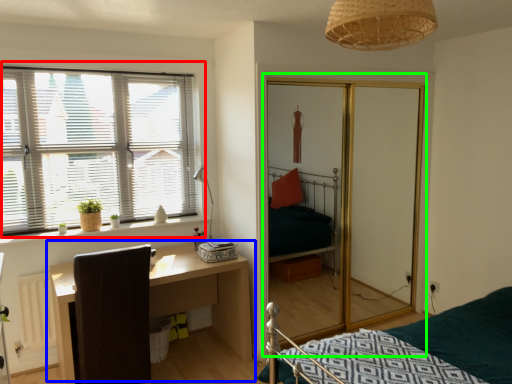
Question: Considering the real-world distances, which object is farthest from window (highlighted by a red box)? table (highlighted by a blue box) or screen door (highlighted by a green box)?

Choices:
 (A) table
 (B) screen door

Answer: (B)